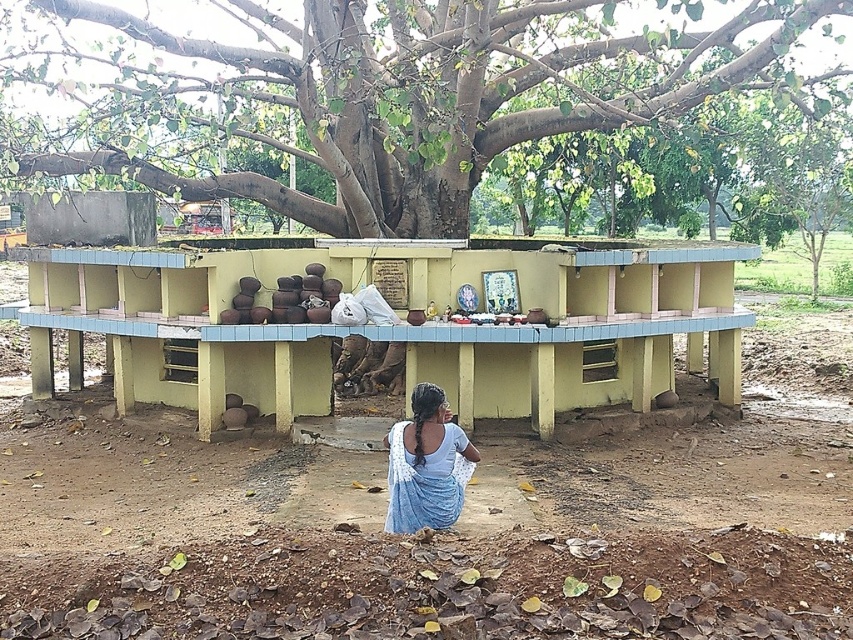
You are planning to place a new decorative statue that requires a base of 10 feet in height. Given the distance between the brown soil at lower center and the green textured tree at upper center, is there enough vertical space available for the statue?

The brown soil at lower center is 22.53 feet from the green textured tree at upper center. Since the statue requires a 10 feet base, there is sufficient vertical space as 22.53 feet exceeds the required 10 feet.

You are standing on the ground looking up at the scene. Which object is higher up in the image, the green textured tree at upper center or the blue fabric at lower center?

The green textured tree at upper center is higher up in the image than the blue fabric at lower center because it is taller according to the description.